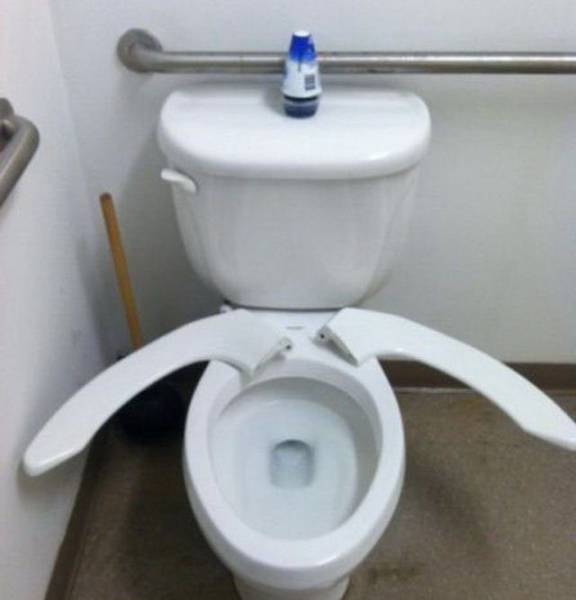
The height and width of the screenshot is (600, 576). Find the location of `plunger`. plunger is located at coordinates (154, 408), (115, 245).